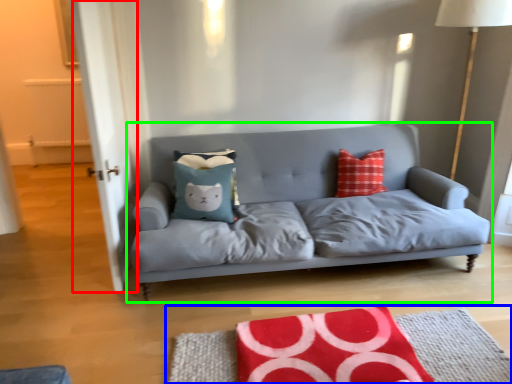
Question: Estimate the real-world distances between objects in this image. Which object is farther from glass door (highlighted by a red box), mat (highlighted by a blue box) or studio couch (highlighted by a green box)?

Choices:
 (A) mat
 (B) studio couch

Answer: (A)